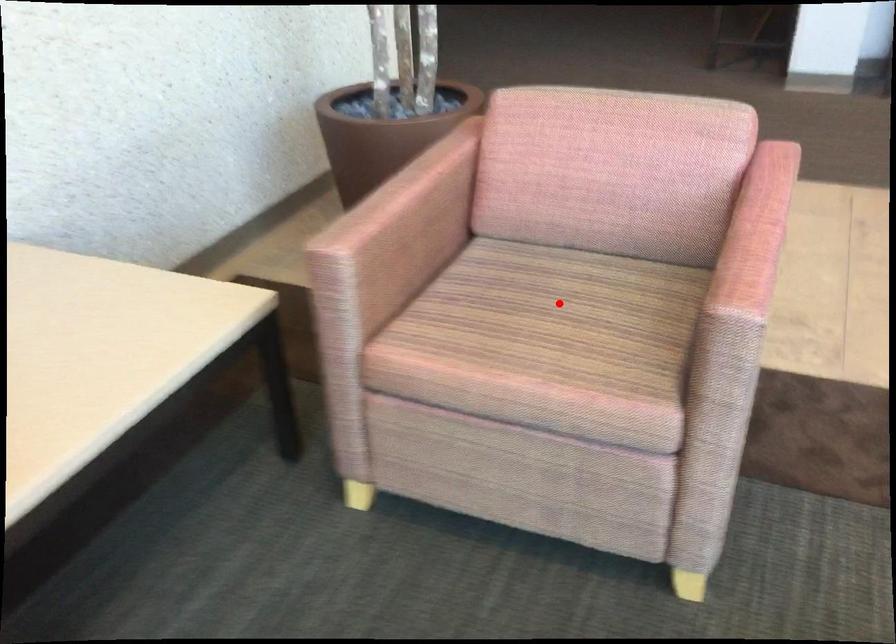
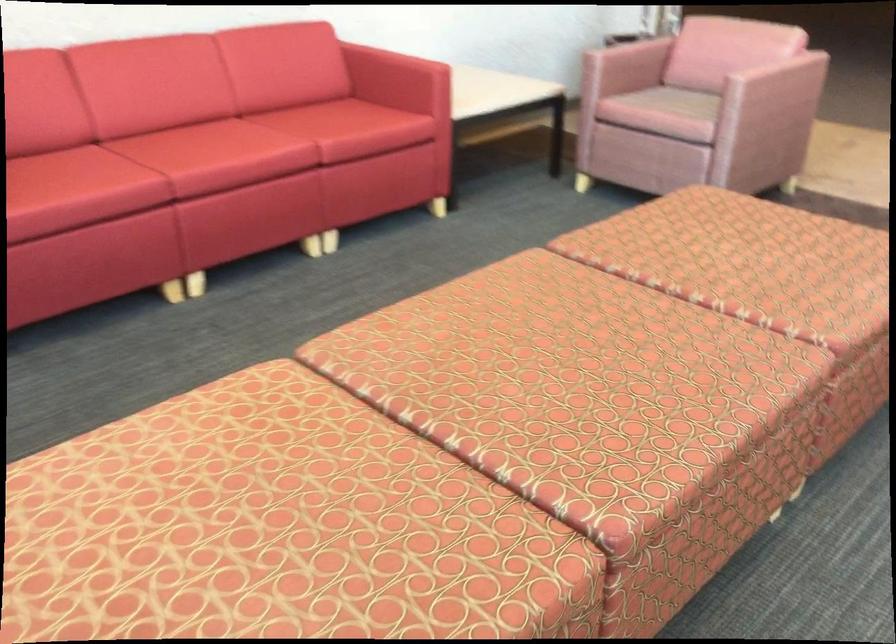
Question: A red point is marked in image1. In image2, is the corresponding 3D point closer to the camera or farther? Reply with the corresponding letter.

Choices:
 (A) The corresponding 3D point is closer.
 (B) The corresponding 3D point is farther.

Answer: (B)